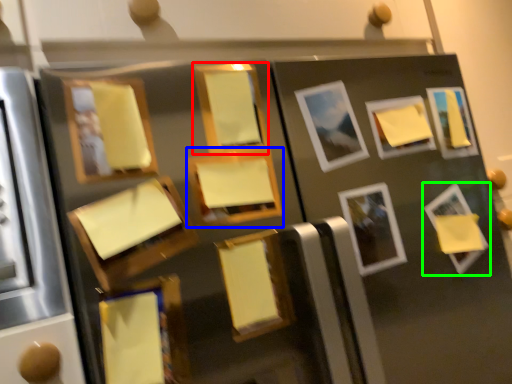
Question: Based on their relative distances, which object is nearer to picture frame (highlighted by a red box)? Choose from picture frame (highlighted by a blue box) and picture frame (highlighted by a green box).

Choices:
 (A) picture frame
 (B) picture frame

Answer: (A)